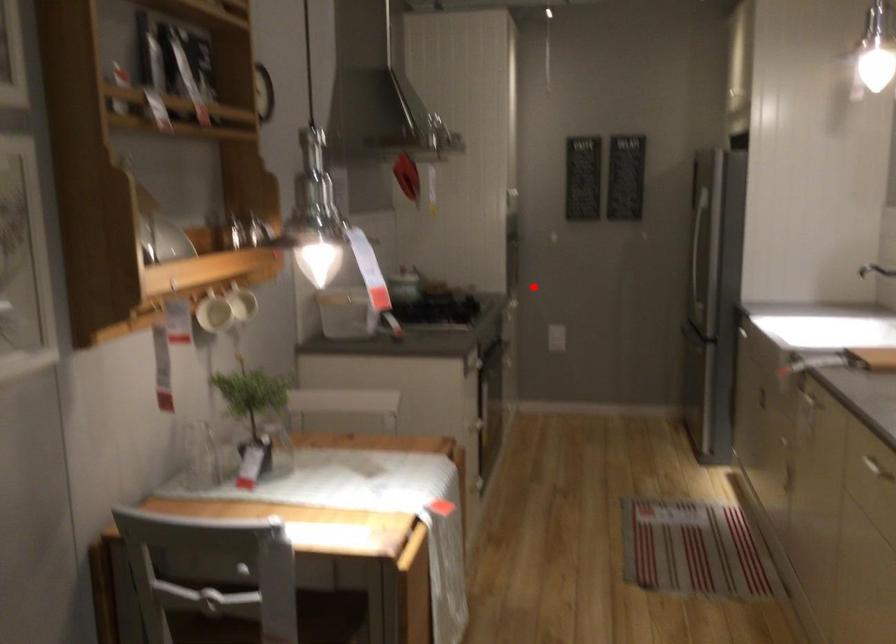
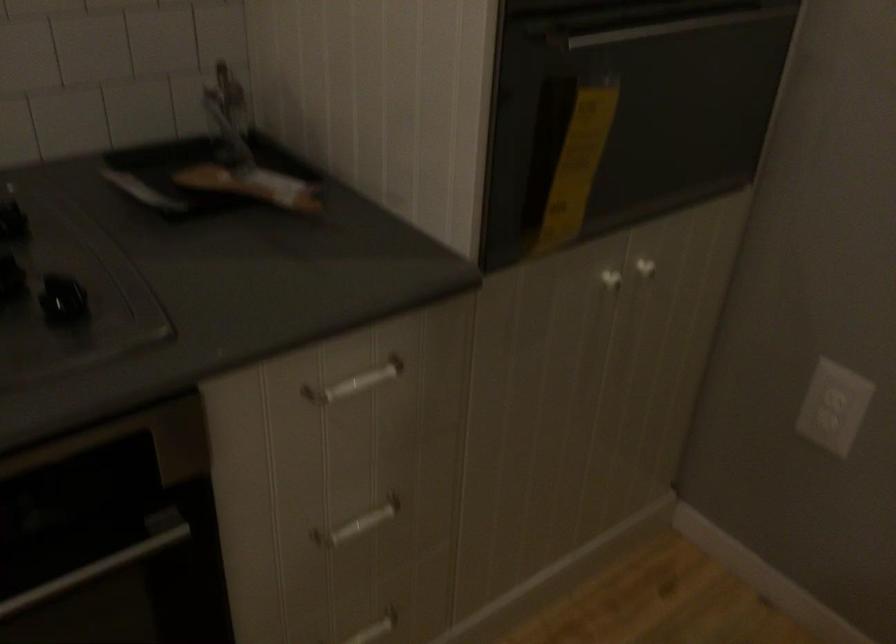
The point at the highlighted location is marked in the first image. Where is the corresponding point in the second image?

(645, 268)